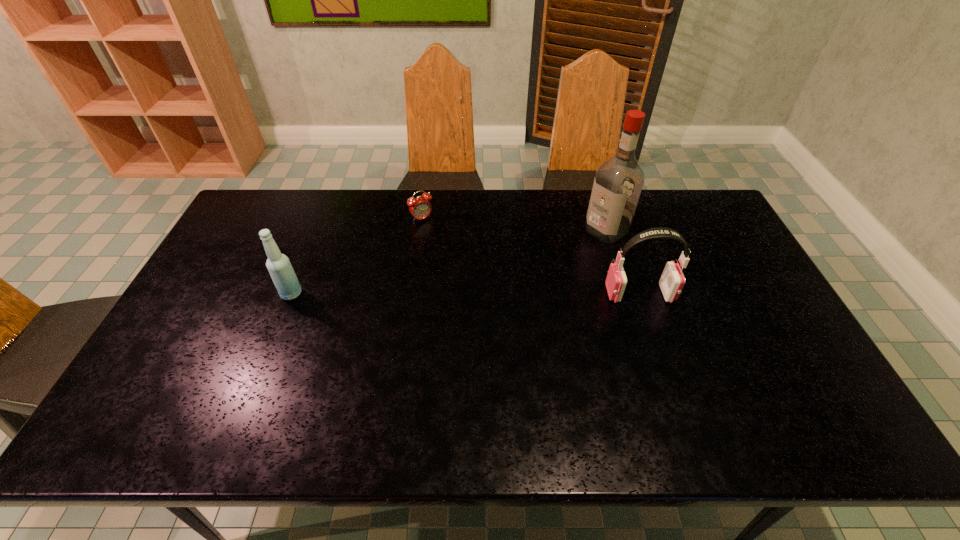
Where is `free space between the liquor and the bottle`? free space between the liquor and the bottle is located at coordinates [x=448, y=262].

Identify which object is the third nearest to the earphone. Please provide its 2D coordinates. Your answer should be formatted as a tuple, i.e. [(x, y)], where the tuple contains the x and y coordinates of a point satisfying the conditions above.

[(281, 271)]

Identify which object is located as the third nearest to the liquor. Please provide its 2D coordinates. Your answer should be formatted as a tuple, i.e. [(x, y)], where the tuple contains the x and y coordinates of a point satisfying the conditions above.

[(281, 271)]

Find the location of a particular element. This screenshot has width=960, height=540. vacant region that satisfies the following two spatial constraints: 1. on the back side of the earphone; 2. on the outer surface of the leftmost object is located at coordinates (292, 294).